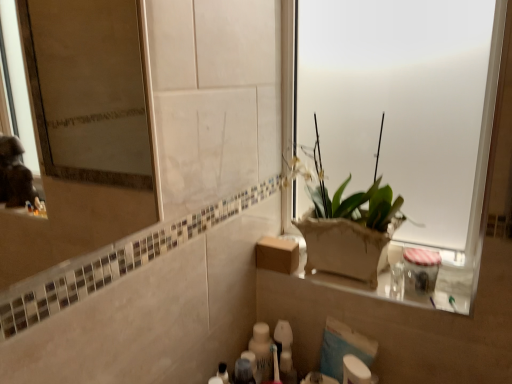
Locate an element on the screen. The image size is (512, 384). translucent plastic toothbrush at lower center, the 3th toiletry from the left is located at coordinates (285, 352).

Find the location of a particular element. white frosted glass at upper right is located at coordinates (407, 117).

Locate an element on the screen. This screenshot has width=512, height=384. white glossy bottle at lower center, which ranks as the 3th toiletry in right-to-left order is located at coordinates (262, 351).

The width and height of the screenshot is (512, 384). What do you see at coordinates (355, 371) in the screenshot?
I see `white matte toilet paper at lower center` at bounding box center [355, 371].

Identify the location of translucent plastic toothbrush at lower center, the 3th toiletry from the left. (285, 352).

In terms of height, does translucent plastic toothbrush at lower center, marked as the second toiletry in a right-to-left arrangement, look taller or shorter compared to white glossy bottle at lower center, which is the 2th toiletry in left-to-right order?

Clearly, translucent plastic toothbrush at lower center, marked as the second toiletry in a right-to-left arrangement, is shorter compared to white glossy bottle at lower center, which is the 2th toiletry in left-to-right order.

Looking at the image, does translucent plastic toothbrush at lower center, the 3th toiletry from the left, seem bigger or smaller compared to white glossy bottle at lower center, which is the 2th toiletry in left-to-right order?

Clearly, translucent plastic toothbrush at lower center, the 3th toiletry from the left, is larger in size than white glossy bottle at lower center, which is the 2th toiletry in left-to-right order.

Looking at this image, can you confirm if translucent plastic toothbrush at lower center, marked as the second toiletry in a right-to-left arrangement, is wider than white glossy bottle at lower center, which is the 2th toiletry in left-to-right order?

Yes, translucent plastic toothbrush at lower center, marked as the second toiletry in a right-to-left arrangement, is wider than white glossy bottle at lower center, which is the 2th toiletry in left-to-right order.

Is translucent plastic toothbrush at lower center, marked as the second toiletry in a right-to-left arrangement, oriented towards white glossy bottle at lower center, which is the 2th toiletry in left-to-right order?

No, translucent plastic toothbrush at lower center, marked as the second toiletry in a right-to-left arrangement, is not oriented towards white glossy bottle at lower center, which is the 2th toiletry in left-to-right order.

Locate an element on the screen. The image size is (512, 384). window in front of the white glossy bottle at lower center, positioned as the 1th toiletry in left-to-right order is located at coordinates point(407,117).

Considering the points (437, 38) and (221, 378), which point is behind, point (437, 38) or point (221, 378)?

The point (221, 378) is farther.

Are white frosted glass at upper right and white glossy bottle at lower center, which is the fourth toiletry in right-to-left order, beside each other?

No, white frosted glass at upper right is not in contact with white glossy bottle at lower center, which is the fourth toiletry in right-to-left order.

Is white frosted glass at upper right outside of white glossy bottle at lower center, positioned as the 1th toiletry in left-to-right order?

Yes, white frosted glass at upper right is located beyond the bounds of white glossy bottle at lower center, positioned as the 1th toiletry in left-to-right order.

Is translucent plastic toothbrush at lower center, marked as the second toiletry in a right-to-left arrangement, not within brown cardboard box at center?

Absolutely, translucent plastic toothbrush at lower center, marked as the second toiletry in a right-to-left arrangement, is external to brown cardboard box at center.

What's the angular difference between translucent plastic toothbrush at lower center, the 3th toiletry from the left, and brown cardboard box at center's facing directions?

2.59 degrees separate the facing orientations of translucent plastic toothbrush at lower center, the 3th toiletry from the left, and brown cardboard box at center.

Between translucent plastic toothbrush at lower center, marked as the second toiletry in a right-to-left arrangement, and brown cardboard box at center, which one has smaller size?

Smaller between the two is translucent plastic toothbrush at lower center, marked as the second toiletry in a right-to-left arrangement.

You are a GUI agent. You are given a task and a screenshot of the screen. Output one action in this format:
    pyautogui.click(x=<x>, y=<y>)
    Task: Click on the cardboard box above the translucent plastic toothbrush at lower center, marked as the second toiletry in a right-to-left arrangement (from the image's perspective)
    
    Given the screenshot: What is the action you would take?
    pyautogui.click(x=277, y=254)

Is translucent plastic toothbrush at lower center, the 3th toiletry from the left, not inside white matte toilet paper at lower center?

Yes, translucent plastic toothbrush at lower center, the 3th toiletry from the left, is not within white matte toilet paper at lower center.

In the scene shown: Which is farther, (x=288, y=369) or (x=365, y=378)?

The point (x=288, y=369) is farther.

Can you confirm if translucent plastic toothbrush at lower center, the 3th toiletry from the left, is positioned to the left of white matte toilet paper at lower center?

Yes, translucent plastic toothbrush at lower center, the 3th toiletry from the left, is to the left of white matte toilet paper at lower center.

What's the angular difference between white glossy bottle at lower center, which is the fourth toiletry in right-to-left order, and brown cardboard box at center's facing directions?

The facing directions of white glossy bottle at lower center, which is the fourth toiletry in right-to-left order, and brown cardboard box at center are 94.7 degrees apart.

Do you think white glossy bottle at lower center, positioned as the 1th toiletry in left-to-right order, is within brown cardboard box at center, or outside of it?

white glossy bottle at lower center, positioned as the 1th toiletry in left-to-right order, lies outside brown cardboard box at center.

Considering the sizes of objects white glossy bottle at lower center, which is the fourth toiletry in right-to-left order, and brown cardboard box at center in the image provided, who is taller, white glossy bottle at lower center, which is the fourth toiletry in right-to-left order, or brown cardboard box at center?

white glossy bottle at lower center, which is the fourth toiletry in right-to-left order, is taller.

Which is behind, white glossy bottle at lower center, which ranks as the 3th toiletry in right-to-left order, or matte brown pot at center?

white glossy bottle at lower center, which ranks as the 3th toiletry in right-to-left order, is more distant.

In terms of width, does white glossy bottle at lower center, which ranks as the 3th toiletry in right-to-left order, look wider or thinner when compared to matte brown pot at center?

Considering their sizes, white glossy bottle at lower center, which ranks as the 3th toiletry in right-to-left order, looks slimmer than matte brown pot at center.

Considering the relative positions of white glossy bottle at lower center, which ranks as the 3th toiletry in right-to-left order, and matte brown pot at center in the image provided, is white glossy bottle at lower center, which ranks as the 3th toiletry in right-to-left order, to the right of matte brown pot at center from the viewer's perspective?

In fact, white glossy bottle at lower center, which ranks as the 3th toiletry in right-to-left order, is to the left of matte brown pot at center.

Does white glossy bottle at lower center, which ranks as the 3th toiletry in right-to-left order, turn towards matte brown pot at center?

No, white glossy bottle at lower center, which ranks as the 3th toiletry in right-to-left order, is not facing towards matte brown pot at center.

Considering the sizes of brown cardboard box at center and clear plastic jar at lower center, which is the 1th toiletry from right to left, in the image, is brown cardboard box at center taller or shorter than clear plastic jar at lower center, which is the 1th toiletry from right to left,?

brown cardboard box at center is shorter than clear plastic jar at lower center, which is the 1th toiletry from right to left.

In terms of size, does brown cardboard box at center appear bigger or smaller than clear plastic jar at lower center, which is the 1th toiletry from right to left?

Considering their sizes, brown cardboard box at center takes up more space than clear plastic jar at lower center, which is the 1th toiletry from right to left.

The width and height of the screenshot is (512, 384). Identify the location of the 3rd toiletry in front of the brown cardboard box at center. (420, 271).

From a real-world perspective, which toiletry is the 1st one above the white glossy bottle at lower center, which ranks as the 3th toiletry in right-to-left order? Please provide its 2D coordinates.

[(285, 352)]

Image resolution: width=512 pixels, height=384 pixels. I want to click on window above the white glossy bottle at lower center, which is the fourth toiletry in right-to-left order (from the image's perspective), so click(407, 117).

Which object lies further to the anchor point brown cardboard box at center, translucent plastic toothbrush at lower center, the 3th toiletry from the left, or white glossy bottle at lower center, which ranks as the 3th toiletry in right-to-left order?

white glossy bottle at lower center, which ranks as the 3th toiletry in right-to-left order, lies further to brown cardboard box at center than the other object.

Considering their positions, is translucent plastic toothbrush at lower center, the 3th toiletry from the left, positioned closer to clear plastic jar at lower center, which is the 1th toiletry from right to left, than white glossy bottle at lower center, positioned as the 1th toiletry in left-to-right order?

Based on the image, translucent plastic toothbrush at lower center, the 3th toiletry from the left, appears to be nearer to clear plastic jar at lower center, which is the 1th toiletry from right to left.

Considering their positions, is matte brown pot at center positioned closer to white frosted glass at upper right than clear plastic jar at lower center, the 4th toiletry viewed from the left?

matte brown pot at center lies closer to white frosted glass at upper right than the other object.

Looking at the image, which one is located further to white matte toilet paper at lower center, white frosted glass at upper right or brown cardboard box at center?

Based on the image, white frosted glass at upper right appears to be further to white matte toilet paper at lower center.

Estimate the real-world distances between objects in this image. Which object is closer to matte brown pot at center, white glossy bottle at lower center, which is the 2th toiletry in left-to-right order, or translucent plastic toothbrush at lower center, the 3th toiletry from the left?

translucent plastic toothbrush at lower center, the 3th toiletry from the left, is positioned closer to the anchor matte brown pot at center.

Based on their spatial positions, is white glossy bottle at lower center, positioned as the 1th toiletry in left-to-right order, or white matte toilet paper at lower center closer to brown cardboard box at center?

Based on the image, white matte toilet paper at lower center appears to be nearer to brown cardboard box at center.

When comparing their distances from white glossy bottle at lower center, positioned as the 1th toiletry in left-to-right order, does white matte toilet paper at lower center or matte brown pot at center seem closer?

white matte toilet paper at lower center is positioned closer to the anchor white glossy bottle at lower center, positioned as the 1th toiletry in left-to-right order.

When comparing their distances from clear plastic jar at lower center, the 4th toiletry viewed from the left, does translucent plastic toothbrush at lower center, marked as the second toiletry in a right-to-left arrangement, or white glossy bottle at lower center, which is the 2th toiletry in left-to-right order, seem further?

Among the two, white glossy bottle at lower center, which is the 2th toiletry in left-to-right order, is located further to clear plastic jar at lower center, the 4th toiletry viewed from the left.

The image size is (512, 384). In order to click on houseplant that lies between white frosted glass at upper right and white glossy bottle at lower center, which is the fourth toiletry in right-to-left order, from top to bottom in this screenshot , I will do `click(348, 226)`.

At what (x,y) coordinates should I click in order to perform the action: click on cardboard box between translucent plastic toothbrush at lower center, the 3th toiletry from the left, and clear plastic jar at lower center, the 4th toiletry viewed from the left. Please return your answer as a coordinate pair (x, y). Looking at the image, I should click on (277, 254).

Where is `cardboard box that lies between white frosted glass at upper right and clear plastic jar at lower center, which is the 1th toiletry from right to left, from top to bottom`? The height and width of the screenshot is (384, 512). cardboard box that lies between white frosted glass at upper right and clear plastic jar at lower center, which is the 1th toiletry from right to left, from top to bottom is located at coordinates (277, 254).

Image resolution: width=512 pixels, height=384 pixels. What are the coordinates of `houseplant that lies between white frosted glass at upper right and white glossy bottle at lower center, which is the 2th toiletry in left-to-right order, from top to bottom` in the screenshot? It's located at (348, 226).